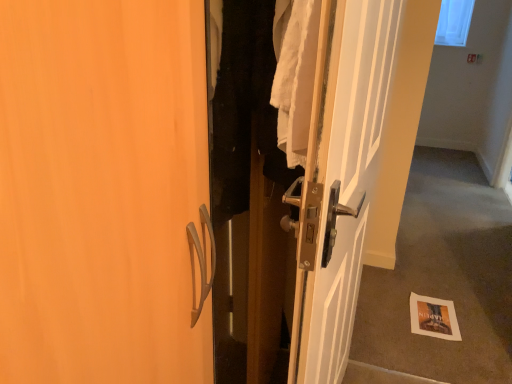
Question: Can you confirm if white glossy door at center is wider than carpeted floor at lower right?

Choices:
 (A) yes
 (B) no

Answer: (A)

Question: Would you say white glossy door at center is a long distance from carpeted floor at lower right?

Choices:
 (A) no
 (B) yes

Answer: (B)

Question: From the image's perspective, does white glossy door at center appear lower than carpeted floor at lower right?

Choices:
 (A) yes
 (B) no

Answer: (A)

Question: Would you say white glossy door at center contains carpeted floor at lower right?

Choices:
 (A) no
 (B) yes

Answer: (A)

Question: Can you confirm if white glossy door at center is bigger than carpeted floor at lower right?

Choices:
 (A) no
 (B) yes

Answer: (B)

Question: Is white glossy door at center looking in the opposite direction of carpeted floor at lower right?

Choices:
 (A) no
 (B) yes

Answer: (A)

Question: Considering the relative positions of white paper at lower right and white glossy door at center in the image provided, is white paper at lower right behind white glossy door at center?

Choices:
 (A) no
 (B) yes

Answer: (B)

Question: Is white paper at lower right beside white glossy door at center?

Choices:
 (A) yes
 (B) no

Answer: (B)

Question: Considering the relative sizes of white paper at lower right and white glossy door at center in the image provided, is white paper at lower right taller than white glossy door at center?

Choices:
 (A) no
 (B) yes

Answer: (A)

Question: Considering the relative sizes of white paper at lower right and white glossy door at center in the image provided, is white paper at lower right smaller than white glossy door at center?

Choices:
 (A) yes
 (B) no

Answer: (A)

Question: Would you say white paper at lower right is outside white glossy door at center?

Choices:
 (A) yes
 (B) no

Answer: (A)

Question: Is white glossy door at center a part of white paper at lower right?

Choices:
 (A) yes
 (B) no

Answer: (B)

Question: Is carpeted floor at lower right smaller than transparent plastic window screen at upper right?

Choices:
 (A) yes
 (B) no

Answer: (B)